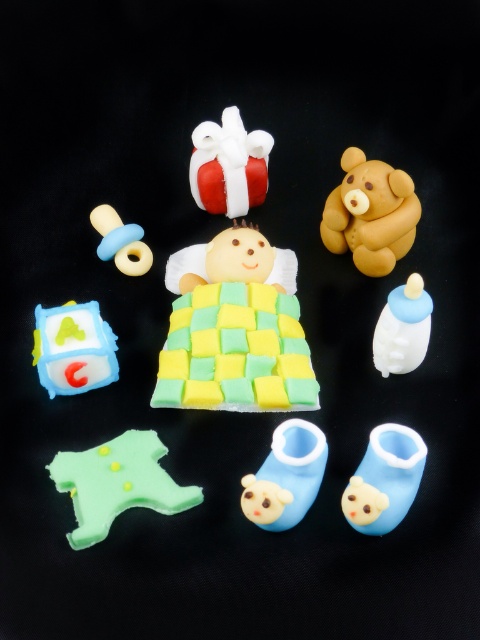
Question: Among these objects, which one is farthest from the camera?

Choices:
 (A) shiny red gift at center
 (B) brown matte teddy bear at upper center
 (C) yellow matte baby at center

Answer: (A)

Question: Which point is closer to the camera?

Choices:
 (A) blue rubber booties at lower center
 (B) yellow matte baby at center
 (C) brown matte teddy bear at upper center

Answer: (A)

Question: Is shiny red gift at center in front of yellow matte pacifier at upper left?

Choices:
 (A) yes
 (B) no

Answer: (A)

Question: Does brown matte teddy bear at upper center have a greater width compared to blue matte booties at center bottom?

Choices:
 (A) yes
 (B) no

Answer: (A)

Question: Is green matte baby bib at lower left positioned in front of blue rubber booties at lower center?

Choices:
 (A) yes
 (B) no

Answer: (B)

Question: Which of these objects is positioned farthest from the yellow matte baby at center?

Choices:
 (A) blue matte booties at center bottom
 (B) brown matte teddy bear at upper center
 (C) yellow matte pacifier at upper left
 (D) shiny red gift at center

Answer: (A)